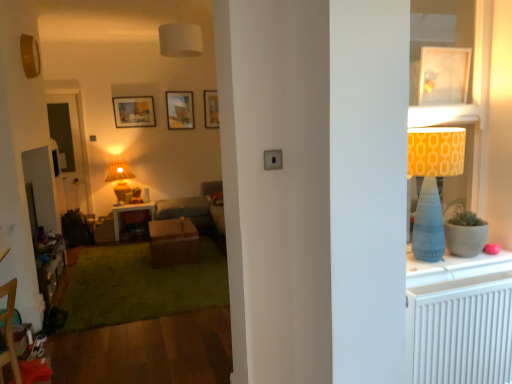
I want to click on blank space situated above white textured radiator at right (from a real-world perspective), so click(471, 281).